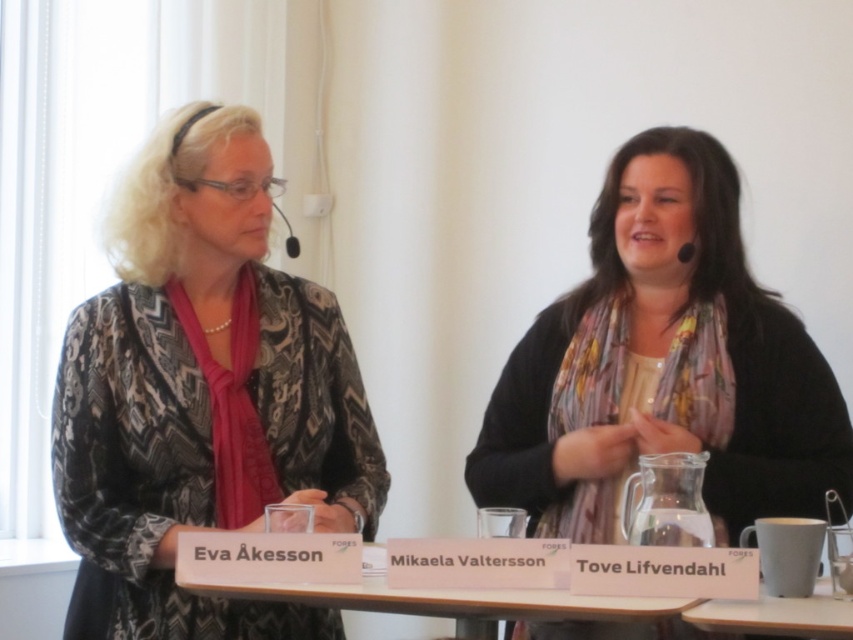
Question: Does patterned fabric jacket at left appear under floral scarf at center?

Choices:
 (A) no
 (B) yes

Answer: (A)

Question: Is patterned fabric jacket at left bigger than floral scarf at center?

Choices:
 (A) no
 (B) yes

Answer: (A)

Question: Which object is positioned farthest from the floral scarf at center?

Choices:
 (A) white paperboard at center
 (B) patterned fabric jacket at left

Answer: (B)

Question: Which point is closer to the camera?

Choices:
 (A) (471, 612)
 (B) (592, 250)
 (C) (207, 524)

Answer: (A)

Question: Which point is closer to the camera taking this photo?

Choices:
 (A) (195, 582)
 (B) (550, 636)
 (C) (204, 403)

Answer: (A)

Question: Does patterned fabric jacket at left have a lesser width compared to white paperboard at center?

Choices:
 (A) yes
 (B) no

Answer: (A)